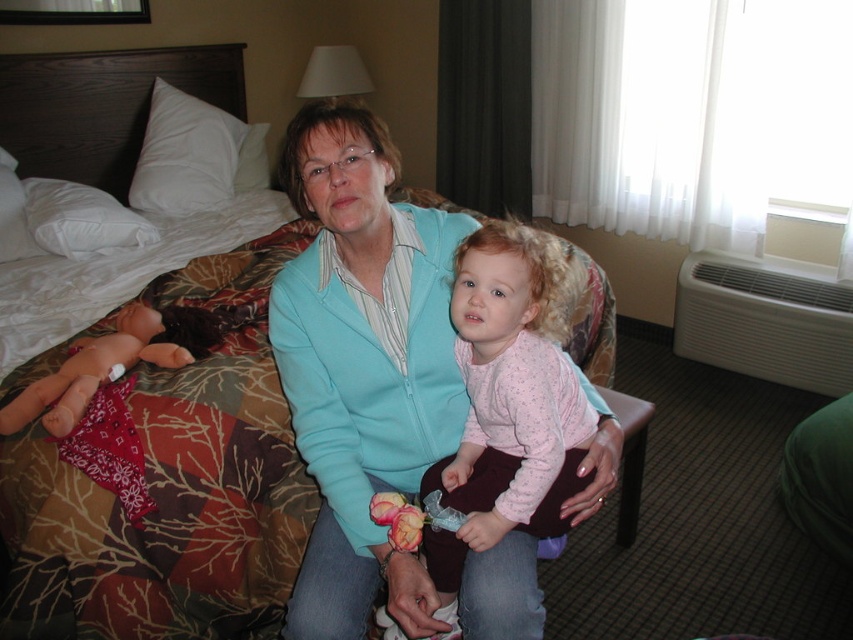
Between point (181, 561) and point (376, 556), which one is positioned behind?

Point (181, 561)

Which is more to the right, patchwork fabric bed at center or matte teal sweater at center?

matte teal sweater at center

Identify the location of patchwork fabric bed at center. The width and height of the screenshot is (853, 640). (171, 483).

Who is higher up, matte teal sweater at center or pink fabric doll at left?

matte teal sweater at center is above.

Where is `matte teal sweater at center`? This screenshot has height=640, width=853. matte teal sweater at center is located at coordinates (363, 364).

Is point (311, 538) farther from viewer compared to point (25, 388)?

No, it is not.

The width and height of the screenshot is (853, 640). I want to click on matte teal sweater at center, so click(363, 364).

Who is positioned more to the right, matte teal sweater at center or pink fabric at center?

From the viewer's perspective, pink fabric at center appears more on the right side.

Is matte teal sweater at center taller than pink fabric at center?

Correct, matte teal sweater at center is much taller as pink fabric at center.

Does point (347, 556) lie in front of point (561, 525)?

That is True.

Locate an element on the screen. This screenshot has height=640, width=853. matte teal sweater at center is located at coordinates (363, 364).